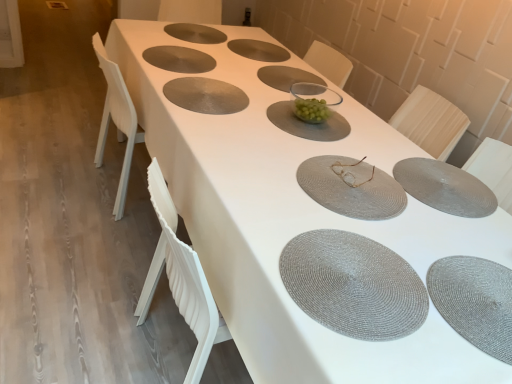
Where is `free location in front of gray woven placemat at center`? This screenshot has width=512, height=384. free location in front of gray woven placemat at center is located at coordinates (212, 125).